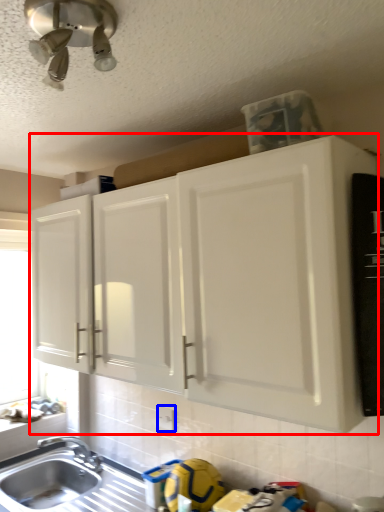
Question: Which point is further to the camera, cabinetry (highlighted by a red box) or electric outlet (highlighted by a blue box)?

Choices:
 (A) cabinetry
 (B) electric outlet

Answer: (B)